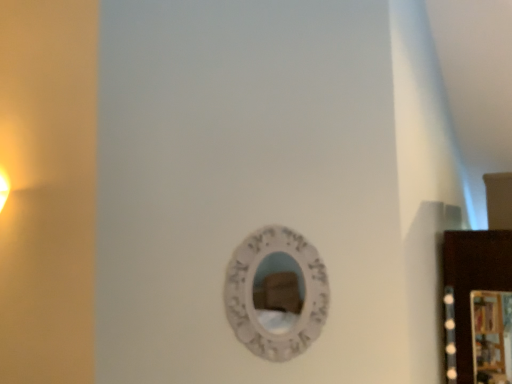
Based on the photo, in order to face white textured mirror at center, should I rotate leftwards or rightwards?

Turn right by 3.276 degrees to look at white textured mirror at center.

Image resolution: width=512 pixels, height=384 pixels. Describe the element at coordinates (276, 293) in the screenshot. I see `white textured mirror at center` at that location.

The width and height of the screenshot is (512, 384). Find the location of `white textured mirror at center`. white textured mirror at center is located at coordinates (276, 293).

Measure the distance between point [272,270] and camera.

The depth of point [272,270] is 5.79 feet.

Where is `wooden picture frame at right`? Image resolution: width=512 pixels, height=384 pixels. wooden picture frame at right is located at coordinates (492, 336).

What do you see at coordinates (492, 336) in the screenshot? I see `wooden picture frame at right` at bounding box center [492, 336].

What is the approximate width of wooden picture frame at right?

wooden picture frame at right is 1.38 inches in width.

Where is `white textured mirror at center`? Image resolution: width=512 pixels, height=384 pixels. white textured mirror at center is located at coordinates (276, 293).

Which object is positioned more to the left, white textured mirror at center or wooden picture frame at right?

white textured mirror at center.

Is white textured mirror at center behind wooden picture frame at right?

No.

In the scene shown: Which point is more distant from viewer, (264, 291) or (490, 339)?

The point (490, 339) is behind.

From the image's perspective, would you say white textured mirror at center is shown under wooden picture frame at right?

No, from the image's perspective, white textured mirror at center is not below wooden picture frame at right.

From a real-world perspective, which is physically above, white textured mirror at center or wooden picture frame at right?

white textured mirror at center, from a real-world perspective.

Which of these two, white textured mirror at center or wooden picture frame at right, is thinner?

With smaller width is wooden picture frame at right.

Does white textured mirror at center have a greater height compared to wooden picture frame at right?

Indeed, white textured mirror at center has a greater height compared to wooden picture frame at right.

Based on their sizes in the image, would you say white textured mirror at center is bigger or smaller than wooden picture frame at right?

Clearly, white textured mirror at center is larger in size than wooden picture frame at right.

Can wooden picture frame at right be found inside white textured mirror at center?

No, white textured mirror at center does not contain wooden picture frame at right.

Is white textured mirror at center in contact with wooden picture frame at right?

No, white textured mirror at center is not touching wooden picture frame at right.

Does white textured mirror at center turn towards wooden picture frame at right?

No, white textured mirror at center is not aimed at wooden picture frame at right.

What's the angular difference between white textured mirror at center and wooden picture frame at right's facing directions?

white textured mirror at center and wooden picture frame at right are facing 43.7 degrees away from each other.

I want to click on picture frame below the white textured mirror at center (from a real-world perspective), so click(492, 336).

Looking at this image, considering the relative positions of wooden picture frame at right and white textured mirror at center in the image provided, is wooden picture frame at right to the left or to the right of white textured mirror at center?

wooden picture frame at right is to the right of white textured mirror at center.

Is wooden picture frame at right closer to camera compared to white textured mirror at center?

That is False.

Considering the positions of point (509, 353) and point (247, 316), is point (509, 353) closer or farther from the camera than point (247, 316)?

Point (509, 353) appears to be farther away from the viewer than point (247, 316).

From the image's perspective, is wooden picture frame at right located above or below white textured mirror at center?

wooden picture frame at right is below white textured mirror at center.

From a real-world perspective, between wooden picture frame at right and white textured mirror at center, who is vertically lower?

In real-world perspective, wooden picture frame at right is lower.

Considering the relative sizes of wooden picture frame at right and white textured mirror at center in the image provided, is wooden picture frame at right wider than white textured mirror at center?

Incorrect, the width of wooden picture frame at right does not surpass that of white textured mirror at center.

Is wooden picture frame at right taller or shorter than white textured mirror at center?

wooden picture frame at right is shorter than white textured mirror at center.

Can you confirm if wooden picture frame at right is smaller than white textured mirror at center?

Yes.

Would you say wooden picture frame at right is outside white textured mirror at center?

Yes.

Is wooden picture frame at right placed right next to white textured mirror at center?

They are not placed beside each other.

Is wooden picture frame at right oriented towards white textured mirror at center?

No, wooden picture frame at right does not turn towards white textured mirror at center.

How different are the orientations of wooden picture frame at right and white textured mirror at center in degrees?

The facing directions of wooden picture frame at right and white textured mirror at center are 43.7 degrees apart.

Identify the location of mirror in front of the wooden picture frame at right. Image resolution: width=512 pixels, height=384 pixels. (276, 293).

Find the location of `picture frame behind the white textured mirror at center`. picture frame behind the white textured mirror at center is located at coordinates (492, 336).

Find the location of a particular element. picture frame below the white textured mirror at center (from the image's perspective) is located at coordinates (492, 336).